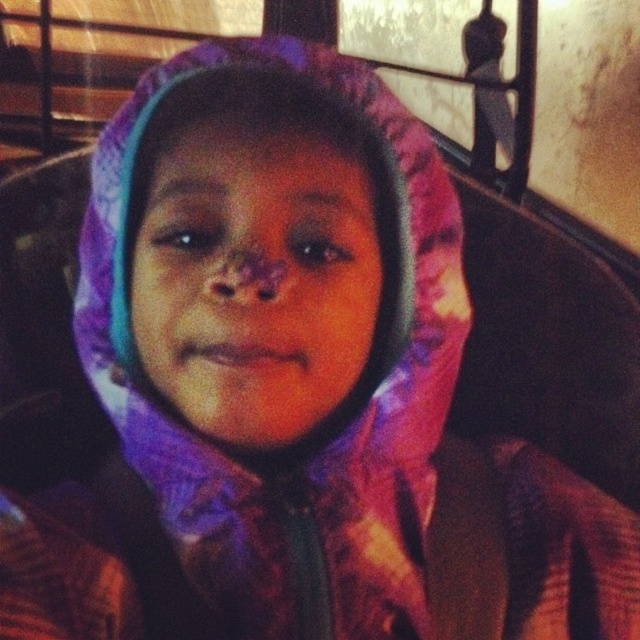
You are holding a 35 cm wide toy that you want to place between yourself and the point at coordinates point (232, 244). Will the toy fit without overlapping the point?

The distance between you and the point (232, 244) is 39.94 centimeters. Since the toy is 35 cm wide, it will fit without overlapping the point as there is enough space.